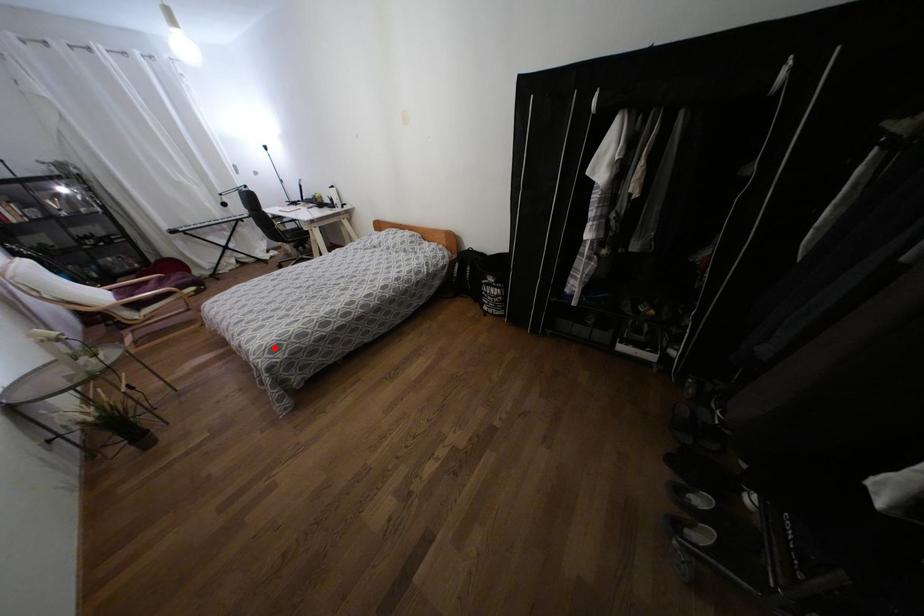
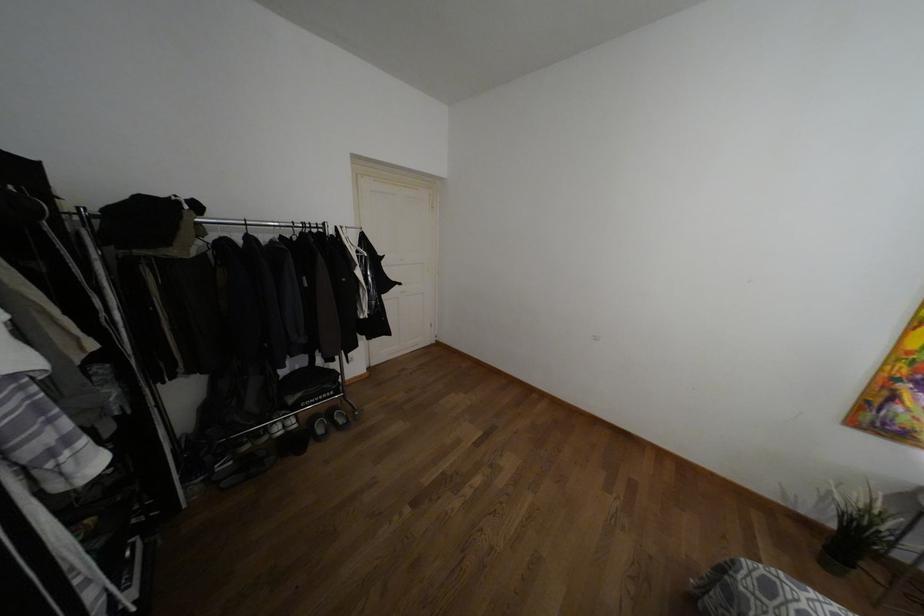
Where in the second image is the point corresponding to the highlighted location from the first image?

(769, 588)